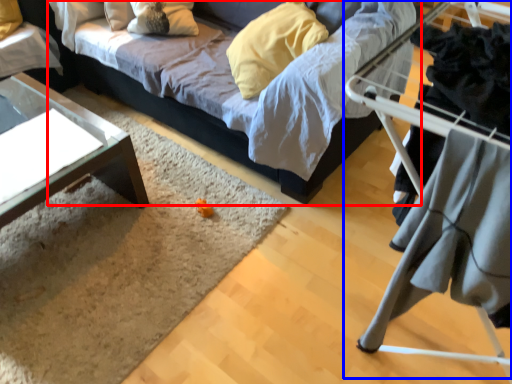
Question: Which point is further to the camera, studio couch (highlighted by a red box) or bunk bed (highlighted by a blue box)?

Choices:
 (A) studio couch
 (B) bunk bed

Answer: (A)